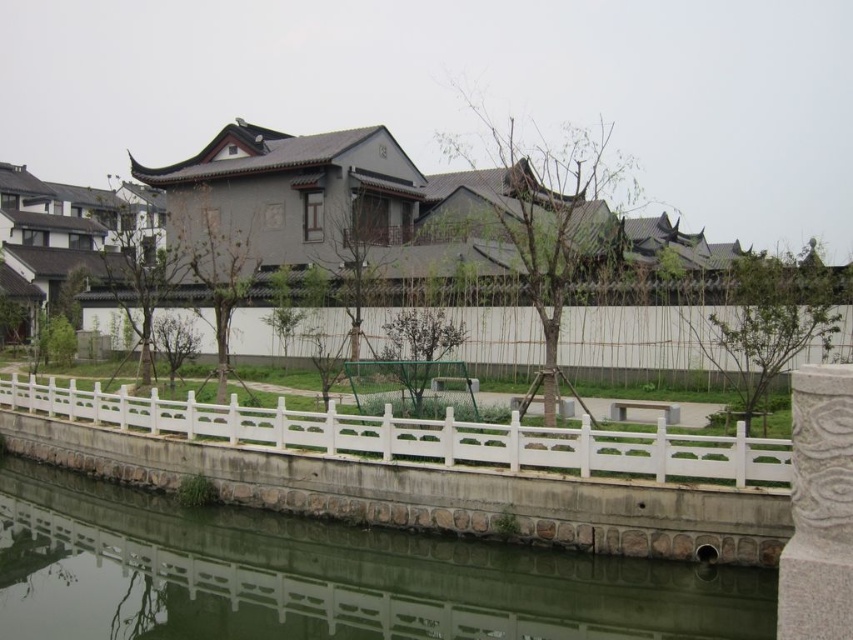
Question: Is smooth concrete river at lower center behind white plastic fence at lower center?

Choices:
 (A) no
 (B) yes

Answer: (A)

Question: Among these objects, which one is nearest to the camera?

Choices:
 (A) smooth concrete river at lower center
 (B) white plastic fence at lower center

Answer: (A)

Question: Among these points, which one is farthest from the camera?

Choices:
 (A) (590, 637)
 (B) (602, 444)

Answer: (B)

Question: Which point appears closest to the camera in this image?

Choices:
 (A) coord(532,451)
 (B) coord(61,566)

Answer: (A)

Question: Is smooth concrete river at lower center to the left of white plastic fence at lower center from the viewer's perspective?

Choices:
 (A) yes
 (B) no

Answer: (B)

Question: Can you confirm if smooth concrete river at lower center is positioned below white plastic fence at lower center?

Choices:
 (A) no
 (B) yes

Answer: (B)